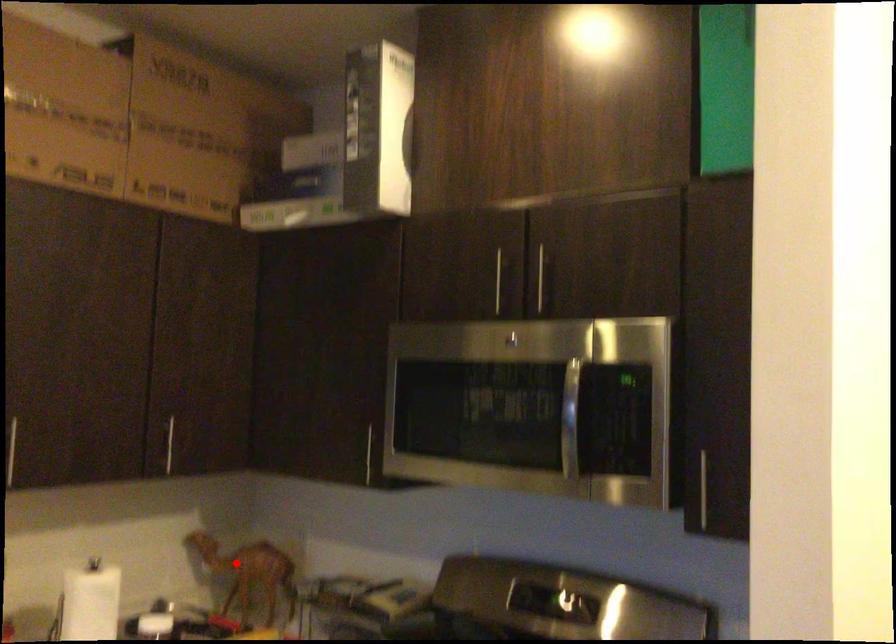
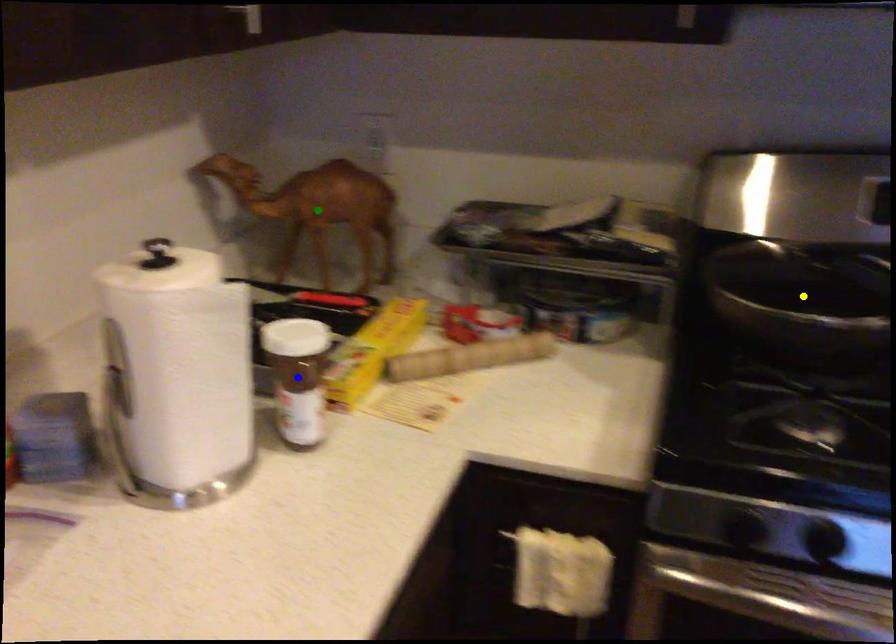
Question: I am providing you with two images of the same scene from different viewpoints. A red point is marked on the first image. You are given multiple points on the second image. Can you choose the point in image 2 that corresponds to the point in image 1?

Choices:
 (A) yellow point
 (B) blue point
 (C) green point

Answer: (C)